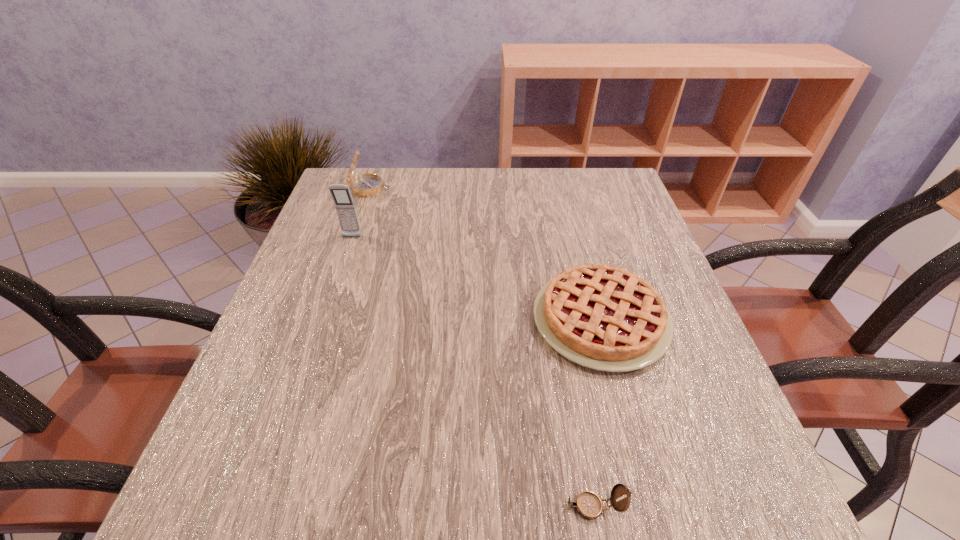
I want to click on the third nearest object, so click(344, 204).

This screenshot has width=960, height=540. In order to click on the tallest object in this screenshot , I will do `click(344, 204)`.

Locate an element on the screen. This screenshot has height=540, width=960. the second tallest object is located at coordinates [364, 185].

Identify the location of the farthest object. The image size is (960, 540). (364, 185).

Locate an element on the screen. the second nearest object is located at coordinates (602, 317).

Where is `the shorter compass`? The image size is (960, 540). the shorter compass is located at coordinates (588, 504).

You are a GUI agent. You are given a task and a screenshot of the screen. Output one action in this format:
    pyautogui.click(x=<x>, y=<y>)
    Task: Click on the nearer compass
    This screenshot has height=540, width=960.
    Given the screenshot: What is the action you would take?
    pyautogui.click(x=588, y=504)

Find the location of `vacant space located on the front-facing side of the tallest object`. vacant space located on the front-facing side of the tallest object is located at coordinates (331, 297).

Identify the location of vacant space located 0.210m with the dial facing the farther compass. (467, 188).

I want to click on free space located 0.240m on the front of the pie, so click(x=656, y=529).